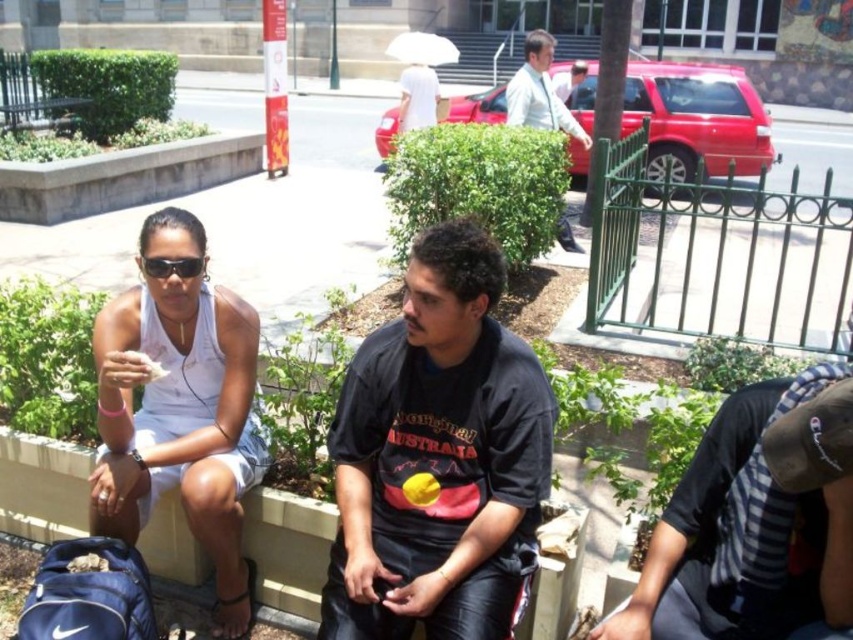
Consider the image. Which of these two, striped shirt at lower right or white fabric tank top at left, stands shorter?

Standing shorter between the two is striped shirt at lower right.

Is striped shirt at lower right bigger than white fabric tank top at left?

Incorrect, striped shirt at lower right is not larger than white fabric tank top at left.

Does point (642, 598) lie behind point (223, 532)?

No, (642, 598) is in front of (223, 532).

I want to click on striped shirt at lower right, so click(755, 522).

Is white fabric tank top at left positioned in front of light blue shirt at center?

That is True.

Looking at this image, who is more distant from viewer, (157,337) or (540,88)?

The point (540,88) is more distant.

Image resolution: width=853 pixels, height=640 pixels. I want to click on white fabric tank top at left, so click(180, 412).

Who is taller, black matte shirt at center or white fabric tank top at left?

white fabric tank top at left

Is black matte shirt at center thinner than white fabric tank top at left?

No.

What do you see at coordinates (438, 456) in the screenshot?
I see `black matte shirt at center` at bounding box center [438, 456].

Where is `black matte shirt at center`? The width and height of the screenshot is (853, 640). black matte shirt at center is located at coordinates (438, 456).